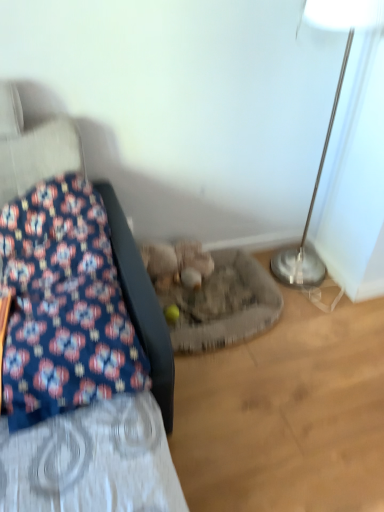
Question: From a real-world perspective, is blue floral fabric at left physically located above or below fluffy beige stuffed animal at center?

Choices:
 (A) below
 (B) above

Answer: (B)

Question: Is point (107, 196) positioned closer to the camera than point (175, 257)?

Choices:
 (A) closer
 (B) farther

Answer: (A)

Question: Which of these objects is positioned closest to the fluffy beige stuffed animal at center?

Choices:
 (A) blue floral fabric at left
 (B) silver metallic floor lamp at right

Answer: (A)

Question: Which of these objects is positioned farthest from the blue floral fabric at left?

Choices:
 (A) fluffy beige stuffed animal at center
 (B) silver metallic floor lamp at right

Answer: (B)